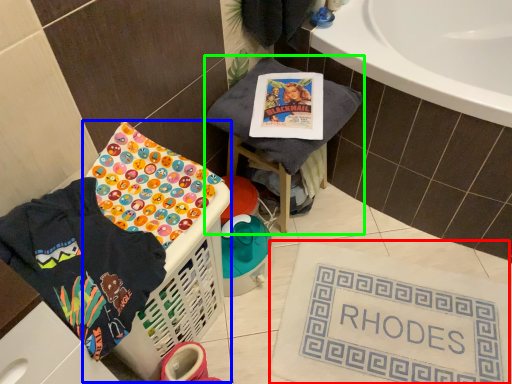
Question: Which is farther away from bath mat (highlighted by a red box)? basket container (highlighted by a blue box) or furniture (highlighted by a green box)?

Choices:
 (A) basket container
 (B) furniture

Answer: (B)